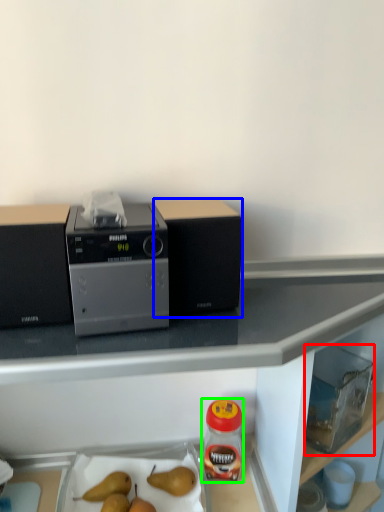
Question: Based on their relative distances, which object is nearer to appliance (highlighted by a red box)? Choose from kitchen appliance (highlighted by a blue box) and bottle (highlighted by a green box).

Choices:
 (A) kitchen appliance
 (B) bottle

Answer: (B)